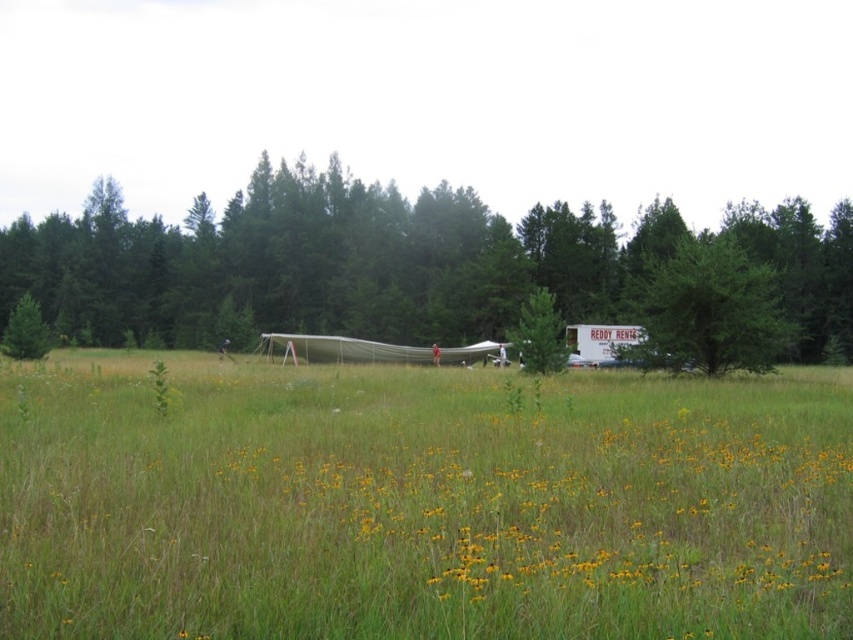
Does green leafy tree at center-right appear on the right side of green matte tree at center?

Correct, you'll find green leafy tree at center-right to the right of green matte tree at center.

Is green leafy tree at center-right closer to camera compared to green matte tree at center?

Result: Yes.

This screenshot has width=853, height=640. Describe the element at coordinates (709, 308) in the screenshot. I see `green leafy tree at center-right` at that location.

Locate an element on the screen. green leafy tree at center-right is located at coordinates (709, 308).

Measure the distance between point (x=602, y=480) and camera.

7.65 meters

Who is positioned more to the right, yellow grass at center or green matte tree at center?

From the viewer's perspective, green matte tree at center appears more on the right side.

Is point (302, 496) positioned behind point (543, 337)?

That is False.

Identify the location of yellow grass at center. This screenshot has width=853, height=640. (585, 506).

Between green leafy tree at center and green matte tree at center, which one is positioned lower?

green matte tree at center is lower down.

Who is positioned more to the left, green leafy tree at center or green matte tree at center?

From the viewer's perspective, green leafy tree at center appears more on the left side.

Is point (3, 275) positioned before point (523, 320)?

No, it is behind (523, 320).

Where is `green leafy tree at center`? This screenshot has width=853, height=640. green leafy tree at center is located at coordinates (326, 262).